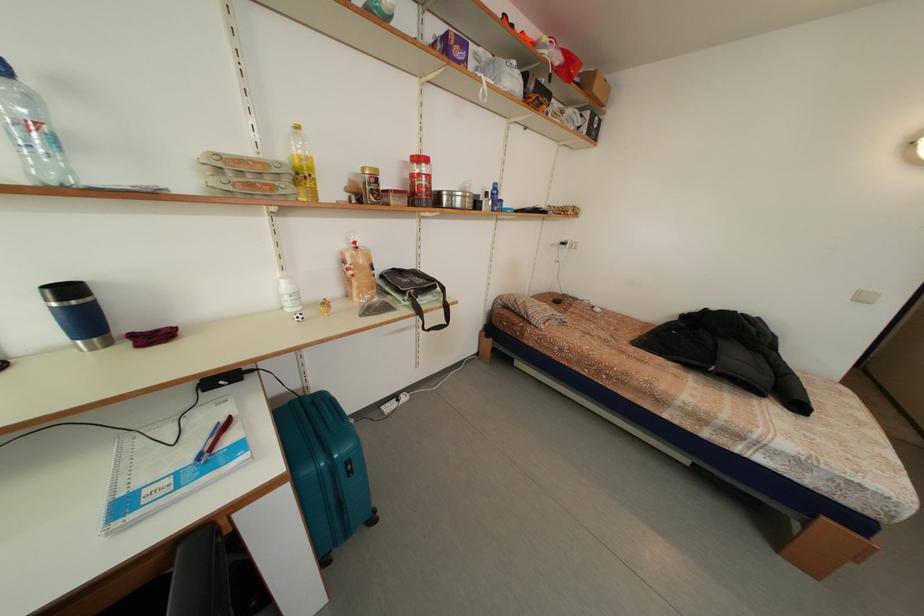
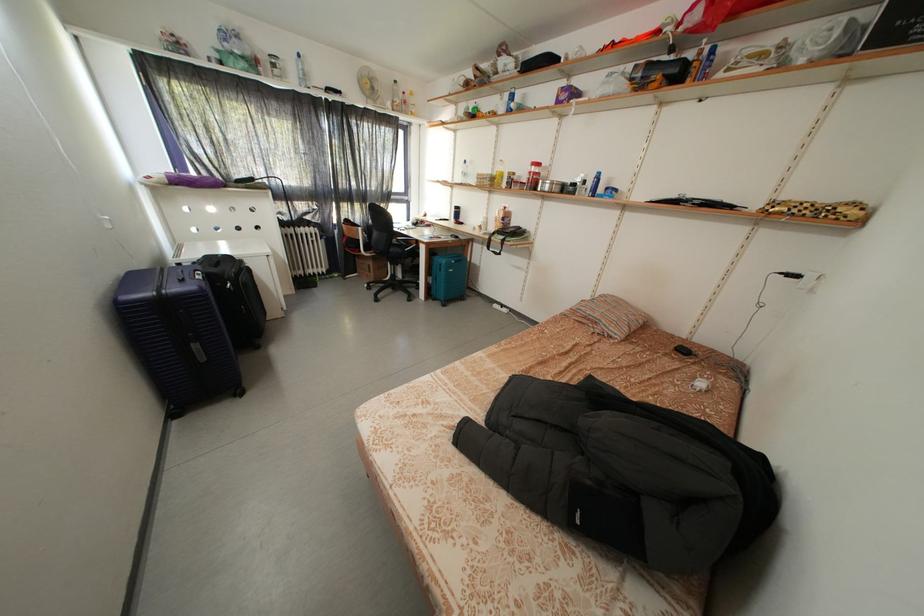
In the second image, find the point that corresponds to (x=467, y=207) in the first image.

(554, 193)